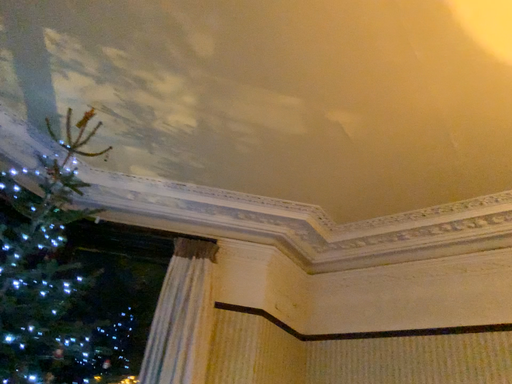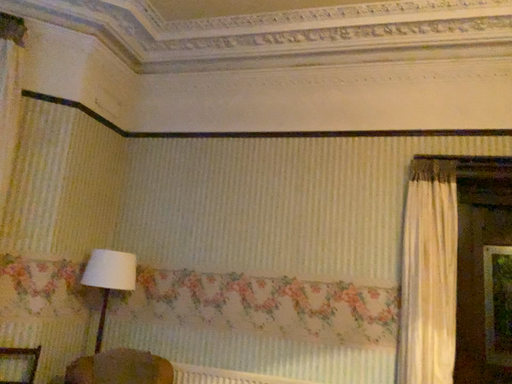
Question: How did the camera likely rotate when shooting the video?

Choices:
 (A) rotated downward
 (B) rotated upward

Answer: (A)